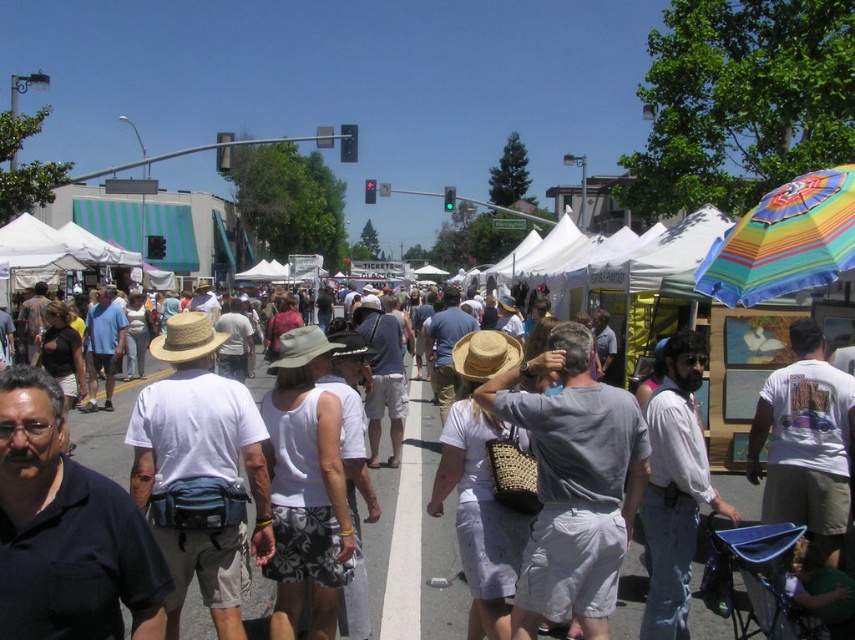
Question: Considering the relative positions of matte white tent at center and rainbow striped fabric umbrella at upper right in the image provided, where is matte white tent at center located with respect to rainbow striped fabric umbrella at upper right?

Choices:
 (A) below
 (B) above

Answer: (A)

Question: Which of the following is the closest to the observer?

Choices:
 (A) (452, 529)
 (B) (821, 262)

Answer: (B)

Question: Considering the relative positions of matte white tent at center and rainbow striped fabric umbrella at upper right in the image provided, where is matte white tent at center located with respect to rainbow striped fabric umbrella at upper right?

Choices:
 (A) right
 (B) left

Answer: (B)

Question: Is the position of matte white tent at center less distant than that of rainbow striped fabric umbrella at upper right?

Choices:
 (A) no
 (B) yes

Answer: (B)